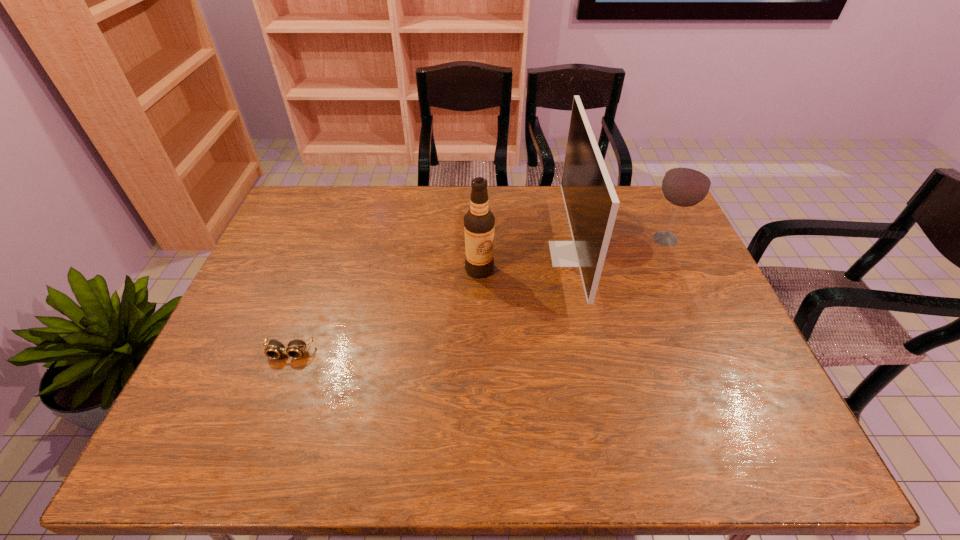
Where is `monitor`? monitor is located at coordinates (591, 202).

You are a GUI agent. You are given a task and a screenshot of the screen. Output one action in this format:
    pyautogui.click(x=<x>, y=<y>)
    Task: Click on the second object from right to left
    
    Given the screenshot: What is the action you would take?
    pyautogui.click(x=591, y=202)

Find the location of a particular element. The image size is (960, 540). the nearer alcohol is located at coordinates (479, 222).

Locate an element on the screen. the left alcohol is located at coordinates (479, 222).

You are a GUI agent. You are given a task and a screenshot of the screen. Output one action in this format:
    pyautogui.click(x=<x>, y=<y>)
    Task: Click on the rightmost object
    The image size is (960, 540).
    Given the screenshot: What is the action you would take?
    coord(687,182)

Locate an element on the screen. Image resolution: width=960 pixels, height=540 pixels. the farther alcohol is located at coordinates pyautogui.click(x=687, y=182).

I want to click on the leftmost object, so click(296, 348).

Locate an element on the screen. goggles is located at coordinates (296, 348).

Where is `free space located 0.250m on the front-facing side of the monitor`? The image size is (960, 540). free space located 0.250m on the front-facing side of the monitor is located at coordinates (470, 254).

Locate an element on the screen. vacant space located 0.260m on the front-facing side of the monitor is located at coordinates (468, 254).